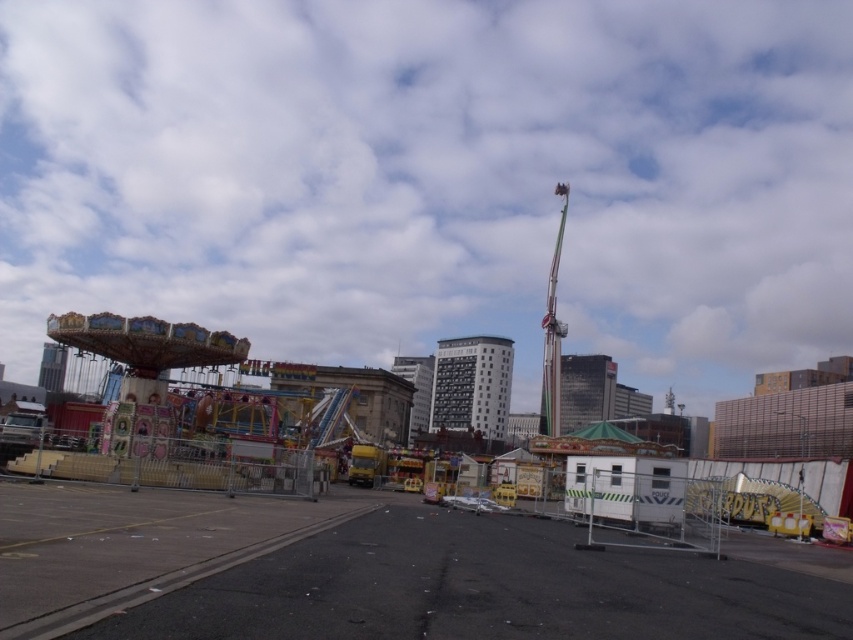
Question: Which point is closer to the camera?

Choices:
 (A) (144, 400)
 (B) (186, 532)

Answer: (B)

Question: Among these points, which one is farthest from the camera?

Choices:
 (A) (233, 448)
 (B) (413, 499)

Answer: (B)

Question: Observing the image, what is the correct spatial positioning of metallic fairground at center in reference to multicolored painted carousel at left?

Choices:
 (A) below
 (B) above

Answer: (A)

Question: Is metallic fairground at center positioned at the back of multicolored painted carousel at left?

Choices:
 (A) no
 (B) yes

Answer: (A)

Question: Among these points, which one is nearest to the camera?

Choices:
 (A) (225, 438)
 (B) (132, 573)

Answer: (B)

Question: Is metallic fairground at center below multicolored painted carousel at left?

Choices:
 (A) no
 (B) yes

Answer: (B)